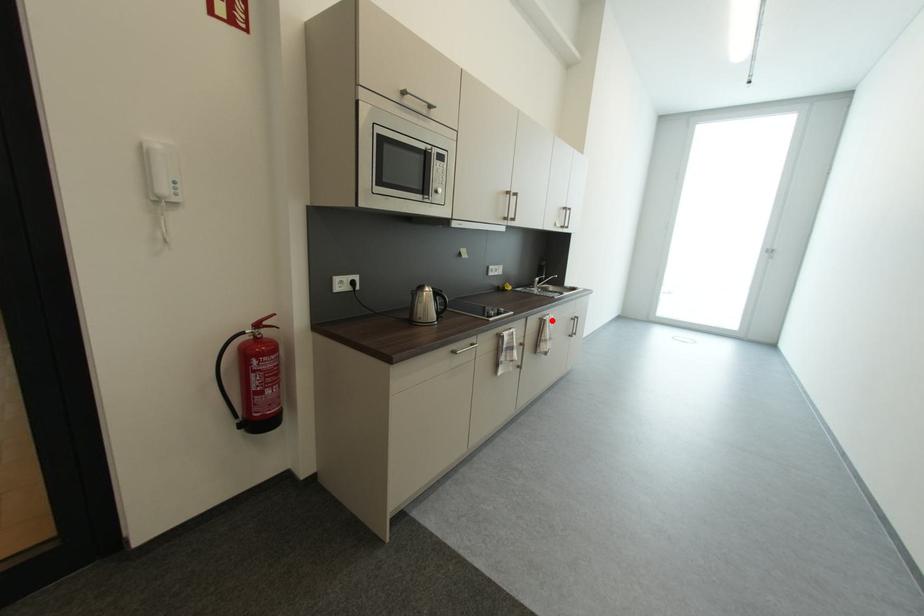
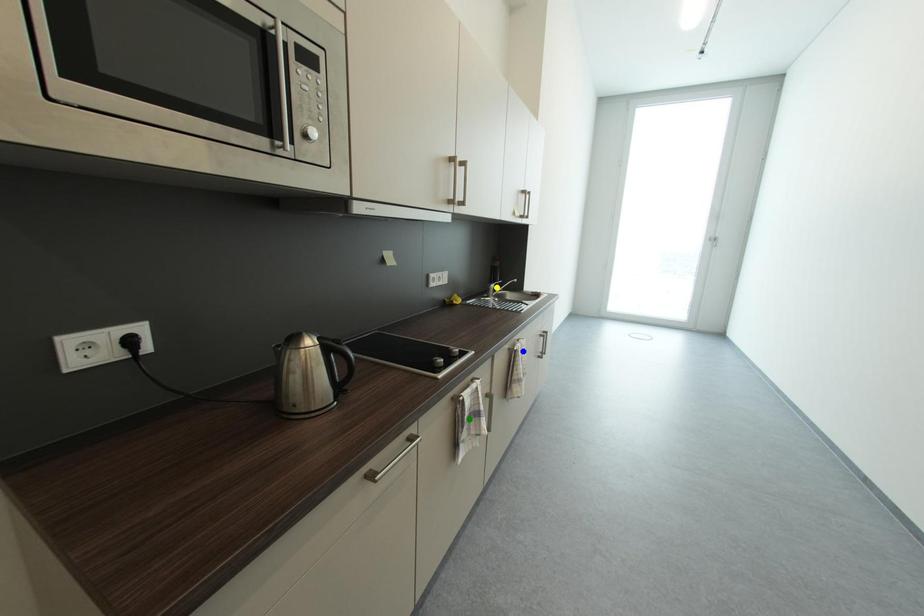
Question: I am providing you with two images of the same scene from different viewpoints. A red point is marked on the first image. You are given multiple points on the second image. In image 2, which mark is for the same physical point as the one in image 1?

Choices:
 (A) green point
 (B) yellow point
 (C) blue point

Answer: (C)